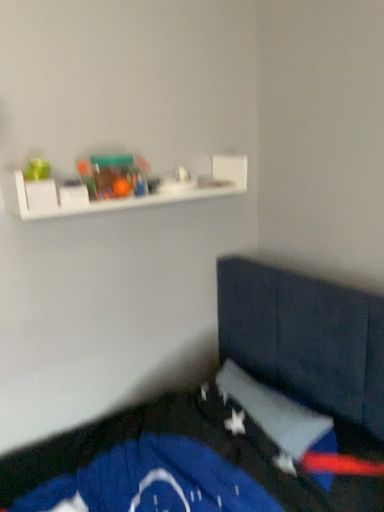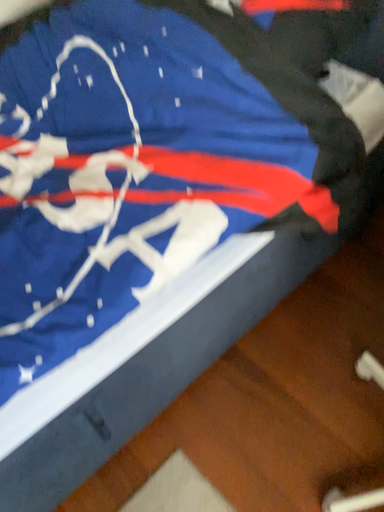
Question: Which way did the camera rotate in the video?

Choices:
 (A) rotated right
 (B) rotated left

Answer: (A)